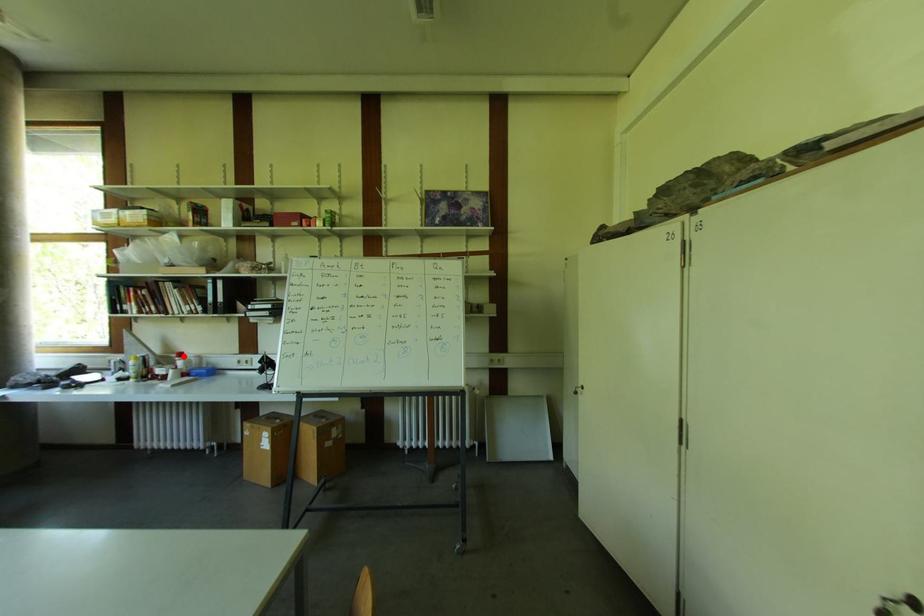
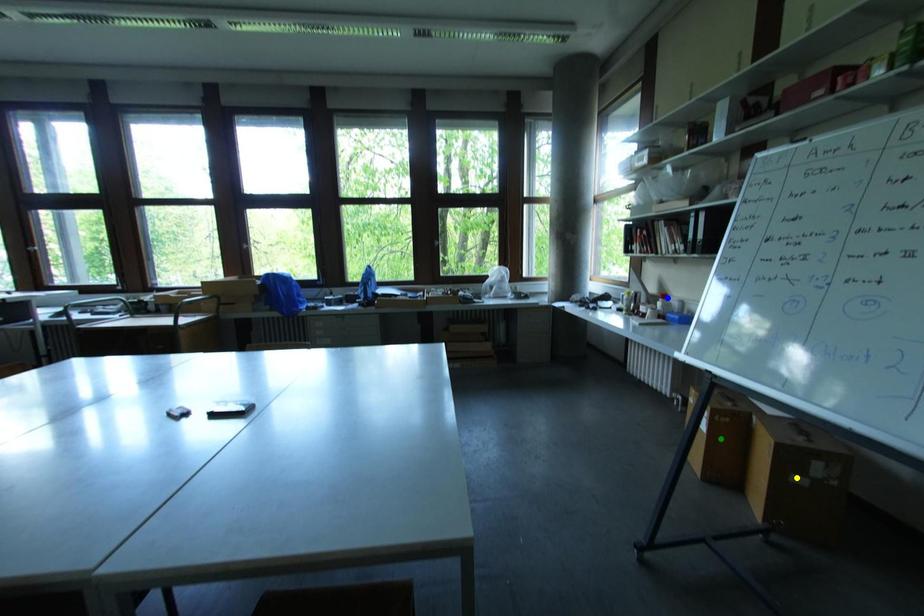
Question: I am providing you with two images of the same scene from different viewpoints. A red point is marked on the first image. You are given multiple points on the second image. Which mark in image 2 goes with the point in image 1?

Choices:
 (A) blue point
 (B) yellow point
 (C) green point

Answer: (A)